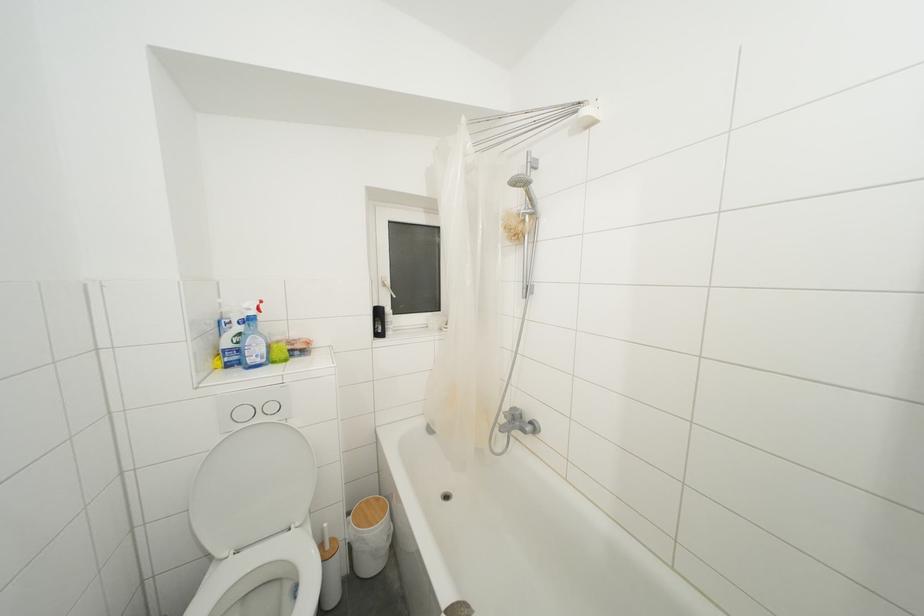
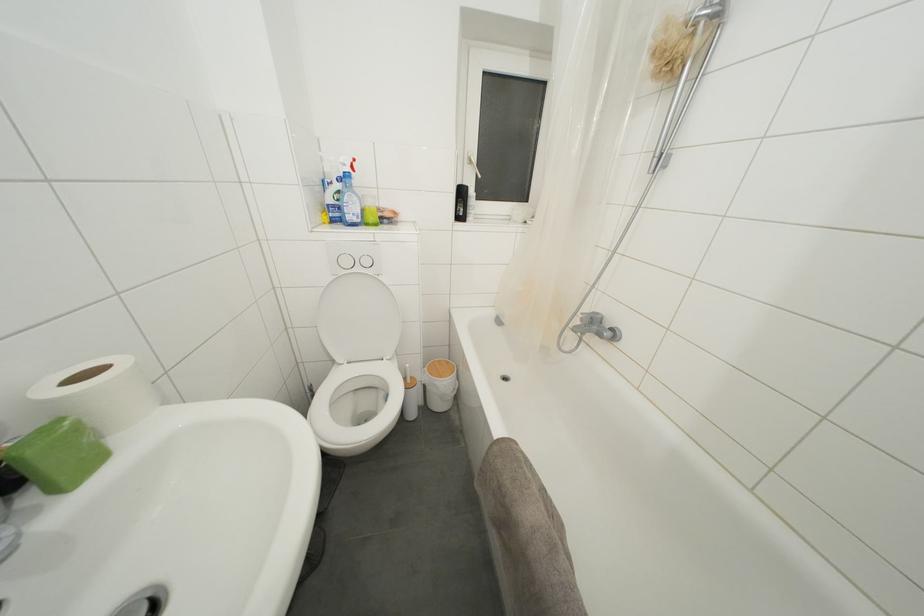
Based on the continuous images, in which direction is the camera rotating?

The camera rotated toward left-down.